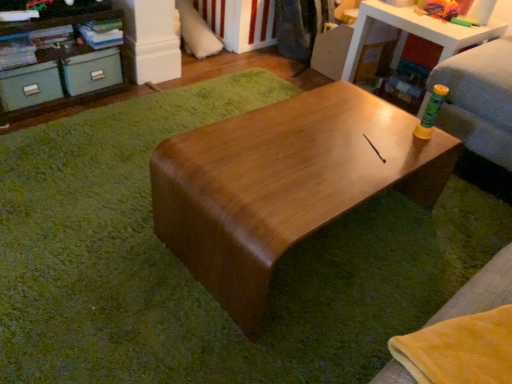
Where is `empty space that is ontop of matte green drawer at left, the first drawer positioned from the left (from a real-world perspective)`? The height and width of the screenshot is (384, 512). empty space that is ontop of matte green drawer at left, the first drawer positioned from the left (from a real-world perspective) is located at coordinates (26, 59).